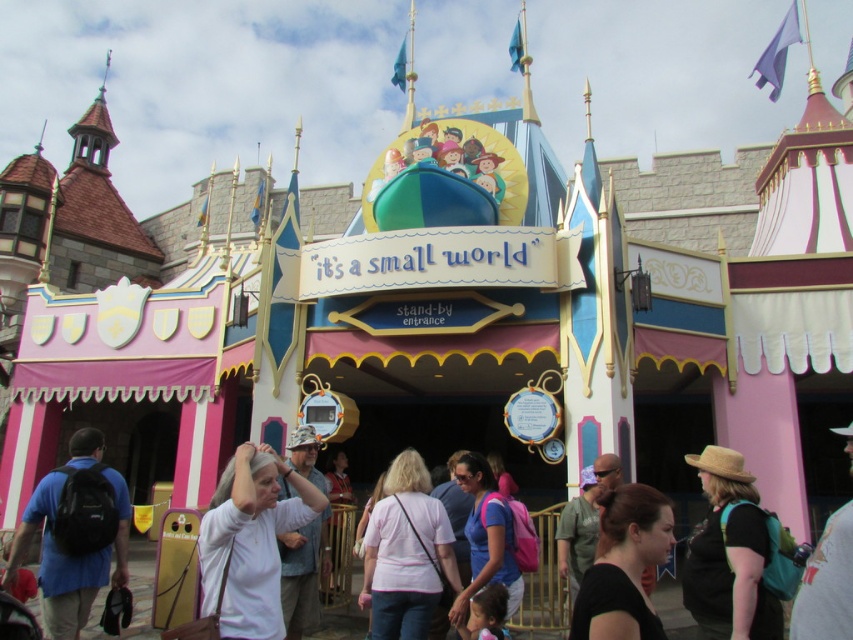
Can you confirm if straw hat at center is positioned below pink fabric hat at upper center?

Yes, straw hat at center is below pink fabric hat at upper center.

In the scene shown: Which of these two, straw hat at center or pink fabric hat at upper center, stands shorter?

straw hat at center is shorter.

Is point (775, 632) positioned in front of point (819, 572)?

No, it is behind (819, 572).

Identify the location of straw hat at center. The height and width of the screenshot is (640, 853). (729, 556).

Is white matte shirt at center to the left of black fabric at center from the viewer's perspective?

Yes, white matte shirt at center is to the left of black fabric at center.

Which is in front, point (270, 604) or point (635, 604)?

Point (635, 604) is in front.

Locate an element on the screen. This screenshot has width=853, height=640. white matte shirt at center is located at coordinates (250, 541).

At what (x,y) coordinates should I click in order to perform the action: click on white matte shirt at center. Please return your answer as a coordinate pair (x, y). Looking at the image, I should click on (250, 541).

Which is more to the right, blue fabric backpack at left or pink fabric hat at upper center?

pink fabric hat at upper center is more to the right.

Does point (93, 428) come farther from viewer compared to point (811, 602)?

Yes, point (93, 428) is behind point (811, 602).

This screenshot has height=640, width=853. What do you see at coordinates (74, 534) in the screenshot?
I see `blue fabric backpack at left` at bounding box center [74, 534].

The height and width of the screenshot is (640, 853). In order to click on blue fabric backpack at left in this screenshot , I will do `click(74, 534)`.